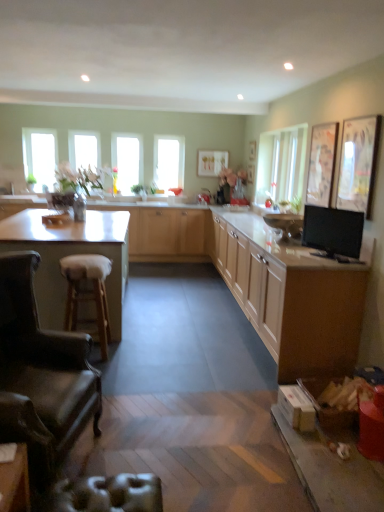
What do you see at coordinates (266, 283) in the screenshot? Image resolution: width=384 pixels, height=512 pixels. I see `matte wood cabinets at center, which is the third cabinetry in back-to-front order` at bounding box center [266, 283].

Image resolution: width=384 pixels, height=512 pixels. Find the location of `matte wood cabinets at center, marked as the 1th cabinetry in a front-to-back arrangement`. matte wood cabinets at center, marked as the 1th cabinetry in a front-to-back arrangement is located at coordinates (266, 283).

Identify the location of wooden bar stool at left. This screenshot has height=512, width=384. (88, 293).

The height and width of the screenshot is (512, 384). What do you see at coordinates (71, 254) in the screenshot? I see `white laminate countertop at left` at bounding box center [71, 254].

The image size is (384, 512). What do you see at coordinates (40, 156) in the screenshot?
I see `clear glass window at upper left, acting as the fourth window starting from the right` at bounding box center [40, 156].

This screenshot has width=384, height=512. Identify the location of clear glass window at upper left, acting as the fourth window starting from the right. (40, 156).

What is the approximate height of clear glass window at upper center, marked as the 3th window in a right-to-left arrangement?

clear glass window at upper center, marked as the 3th window in a right-to-left arrangement, is 36.82 inches tall.

The width and height of the screenshot is (384, 512). What do you see at coordinates (167, 233) in the screenshot? I see `light wood cabinet at center, marked as the third cabinetry in a front-to-back arrangement` at bounding box center [167, 233].

Locate an element on the screen. The image size is (384, 512). matte wood cabinets at center, which is the third cabinetry in back-to-front order is located at coordinates [x=266, y=283].

Considering the relative positions of clear glass window at upper center, marked as the 3th window in a right-to-left arrangement, and light wood cabinet at center, marked as the third cabinetry in a front-to-back arrangement, in the image provided, is clear glass window at upper center, marked as the 3th window in a right-to-left arrangement, to the right of light wood cabinet at center, marked as the third cabinetry in a front-to-back arrangement, from the viewer's perspective?

In fact, clear glass window at upper center, marked as the 3th window in a right-to-left arrangement, is to the left of light wood cabinet at center, marked as the third cabinetry in a front-to-back arrangement.

Based on the photo, considering the relative sizes of clear glass window at upper center, marked as the 3th window in a right-to-left arrangement, and light wood cabinet at center, marked as the third cabinetry in a front-to-back arrangement, in the image provided, is clear glass window at upper center, marked as the 3th window in a right-to-left arrangement, thinner than light wood cabinet at center, marked as the third cabinetry in a front-to-back arrangement,?

Indeed, clear glass window at upper center, marked as the 3th window in a right-to-left arrangement, has a lesser width compared to light wood cabinet at center, marked as the third cabinetry in a front-to-back arrangement.

Where is `the 4th window above when counting from the light wood cabinet at center, which appears as the first cabinetry when viewed from the back (from the image's perspective)`? The image size is (384, 512). the 4th window above when counting from the light wood cabinet at center, which appears as the first cabinetry when viewed from the back (from the image's perspective) is located at coordinates (85, 152).

Looking at this image, measure the distance between clear glass window at upper center, marked as the 3th window in a right-to-left arrangement, and light wood cabinet at center, marked as the third cabinetry in a front-to-back arrangement.

clear glass window at upper center, marked as the 3th window in a right-to-left arrangement, is 5.24 feet from light wood cabinet at center, marked as the third cabinetry in a front-to-back arrangement.

Would you consider black glossy tv at right to be distant from matte wood cabinets at center, marked as the 1th cabinetry in a front-to-back arrangement?

black glossy tv at right is near matte wood cabinets at center, marked as the 1th cabinetry in a front-to-back arrangement, not far away.

In the scene shown: From a real-world perspective, between black glossy tv at right and matte wood cabinets at center, which is the third cabinetry in back-to-front order, who is vertically lower?

From a 3D spatial view, matte wood cabinets at center, which is the third cabinetry in back-to-front order, is below.

Which object is thinner, black glossy tv at right or matte wood cabinets at center, which is the third cabinetry in back-to-front order?

black glossy tv at right is thinner.

From the picture: Is matte wood cabinets at center, which is the third cabinetry in back-to-front order, not within clear glass window at upper left, the first window when ordered from left to right?

Indeed, matte wood cabinets at center, which is the third cabinetry in back-to-front order, is completely outside clear glass window at upper left, the first window when ordered from left to right.

Is matte wood cabinets at center, marked as the 1th cabinetry in a front-to-back arrangement, oriented towards clear glass window at upper left, acting as the fourth window starting from the right?

No, matte wood cabinets at center, marked as the 1th cabinetry in a front-to-back arrangement, is not facing towards clear glass window at upper left, acting as the fourth window starting from the right.

In terms of width, does matte wood cabinets at center, marked as the 1th cabinetry in a front-to-back arrangement, look wider or thinner when compared to clear glass window at upper left, acting as the fourth window starting from the right?

In the image, matte wood cabinets at center, marked as the 1th cabinetry in a front-to-back arrangement, appears to be wider than clear glass window at upper left, acting as the fourth window starting from the right.

Find the location of a particular element. the 2nd cabinetry to the right of the clear glass window at upper left, acting as the fourth window starting from the right, starting your count from the anchor is located at coordinates (266, 283).

Is clear glass window at upper left, acting as the fourth window starting from the right, aimed at clear glass window at center, which is the third window from left to right?

No, clear glass window at upper left, acting as the fourth window starting from the right, is not turned towards clear glass window at center, which is the third window from left to right.

From the image's perspective, which is above, clear glass window at upper left, the first window when ordered from left to right, or clear glass window at center, which appears as the second window when viewed from the right?

clear glass window at upper left, the first window when ordered from left to right, is shown above in the image.

How far apart are clear glass window at upper left, acting as the fourth window starting from the right, and clear glass window at center, which appears as the second window when viewed from the right?

clear glass window at upper left, acting as the fourth window starting from the right, and clear glass window at center, which appears as the second window when viewed from the right, are 1.19 meters apart.

Which object is further away from the camera taking this photo, clear glass window at upper left, acting as the fourth window starting from the right, or clear glass window at center, which appears as the second window when viewed from the right?

clear glass window at center, which appears as the second window when viewed from the right, is more distant.

Based on the photo, which object is positioned more to the right, leather armchair at lower left or white laminate countertop at left?

leather armchair at lower left.

Is point (34, 470) positioned behind point (38, 228)?

No.

From the image's perspective, between leather armchair at lower left and white laminate countertop at left, which one is located above?

From the image's view, white laminate countertop at left is above.

Measure the distance from leather armchair at lower left to white laminate countertop at left.

The distance of leather armchair at lower left from white laminate countertop at left is 1.10 meters.

Can you tell me how much leather armchair at lower left and clear glass window at center, the 4th window when ordered from left to right, differ in facing direction?

75.4 degrees.

Which of these two, leather armchair at lower left or clear glass window at center, which is the first window from right to left, is bigger?

leather armchair at lower left is bigger.

Which object is thinner, leather armchair at lower left or clear glass window at center, the 4th window when ordered from left to right?

Thinner between the two is clear glass window at center, the 4th window when ordered from left to right.

From the image's perspective, which window is the 2nd one above the leather armchair at lower left? Please provide its 2D coordinates.

[(169, 161)]

Is leather armchair at lower left placed right next to black glossy tv at right?

No, leather armchair at lower left is not beside black glossy tv at right.

What's the angular difference between leather armchair at lower left and black glossy tv at right's facing directions?

The facing directions of leather armchair at lower left and black glossy tv at right are 138 degrees apart.

Looking at this image, is black glossy tv at right inside leather armchair at lower left?

Actually, black glossy tv at right is outside leather armchair at lower left.

From a real-world perspective, is leather armchair at lower left physically below black glossy tv at right?

Correct, in the physical world, leather armchair at lower left is lower than black glossy tv at right.

Starting from the light wood cabinet at center, marked as the third cabinetry in a front-to-back arrangement, which window is the 1st one to the left? Please provide its 2D coordinates.

[(85, 152)]

Image resolution: width=384 pixels, height=512 pixels. What are the coordinates of `appliance that is above the matte wood cabinets at center, marked as the 1th cabinetry in a front-to-back arrangement (from a real-world perspective)` in the screenshot? It's located at (333, 230).

Estimate the real-world distances between objects in this image. Which object is closer to light wood cabinet at center, marked as the third cabinetry in a front-to-back arrangement, clear glass window at center, which is the first window from right to left, or black glossy tv at right?

Based on the image, clear glass window at center, which is the first window from right to left, appears to be nearer to light wood cabinet at center, marked as the third cabinetry in a front-to-back arrangement.

Which object lies nearer to the anchor point matte wood cabinets at center, marked as the 1th cabinetry in a front-to-back arrangement, light wood cabinet at center, marked as the third cabinetry in a front-to-back arrangement, or black glossy tv at right?

black glossy tv at right is closer to matte wood cabinets at center, marked as the 1th cabinetry in a front-to-back arrangement.

Which object lies further to the anchor point clear glass window at upper left, the first window when ordered from left to right, light wood cabinet at center, marked as the third cabinetry in a front-to-back arrangement, or black glossy tv at right?

The object further to clear glass window at upper left, the first window when ordered from left to right, is black glossy tv at right.

Consider the image. Considering their positions, is light wood cabinet at right, which is the 2th cabinetry from back to front, positioned further to clear glass window at upper left, the first window when ordered from left to right, than matte wood cabinets at center, which is the third cabinetry in back-to-front order?

light wood cabinet at right, which is the 2th cabinetry from back to front, is positioned further to the anchor clear glass window at upper left, the first window when ordered from left to right.

Which object lies nearer to the anchor point clear glass window at upper left, acting as the fourth window starting from the right, light wood cabinet at right, which is the 2th cabinetry from back to front, or clear glass window at center, which appears as the second window when viewed from the right?

Based on the image, clear glass window at center, which appears as the second window when viewed from the right, appears to be nearer to clear glass window at upper left, acting as the fourth window starting from the right.

Looking at the image, which one is located closer to metallic silver swivel chair at lower left, light wood cabinet at right, which ranks as the 2th cabinetry in front-to-back order, or wooden bar stool at left?

Among the two, wooden bar stool at left is located nearer to metallic silver swivel chair at lower left.

Looking at the image, which one is located closer to black glossy tv at right, light wood cabinet at center, marked as the third cabinetry in a front-to-back arrangement, or clear glass window at center, which appears as the second window when viewed from the right?

The object closer to black glossy tv at right is light wood cabinet at center, marked as the third cabinetry in a front-to-back arrangement.

Based on their spatial positions, is matte wood cabinets at center, which is the third cabinetry in back-to-front order, or clear glass window at upper left, the first window when ordered from left to right, closer to clear glass window at upper center, the second window positioned from the left?

clear glass window at upper left, the first window when ordered from left to right.

I want to click on bar stool between leather armchair at lower left and clear glass window at upper center, marked as the 3th window in a right-to-left arrangement, in the front-back direction, so click(88, 293).

The width and height of the screenshot is (384, 512). In order to click on countertop between black glossy tv at right and clear glass window at upper center, marked as the 3th window in a right-to-left arrangement, from front to back in this screenshot , I will do tap(71, 254).

At what (x,y) coordinates should I click in order to perform the action: click on countertop between metallic silver swivel chair at lower left and clear glass window at upper center, marked as the 3th window in a right-to-left arrangement, in the front-back direction. Please return your answer as a coordinate pair (x, y). The width and height of the screenshot is (384, 512). Looking at the image, I should click on (71, 254).

Identify the location of bar stool between white laminate countertop at left and black glossy tv at right from left to right. (88, 293).